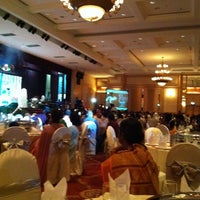
The height and width of the screenshot is (200, 200). Find the location of `black speaker`. black speaker is located at coordinates point(79,73).